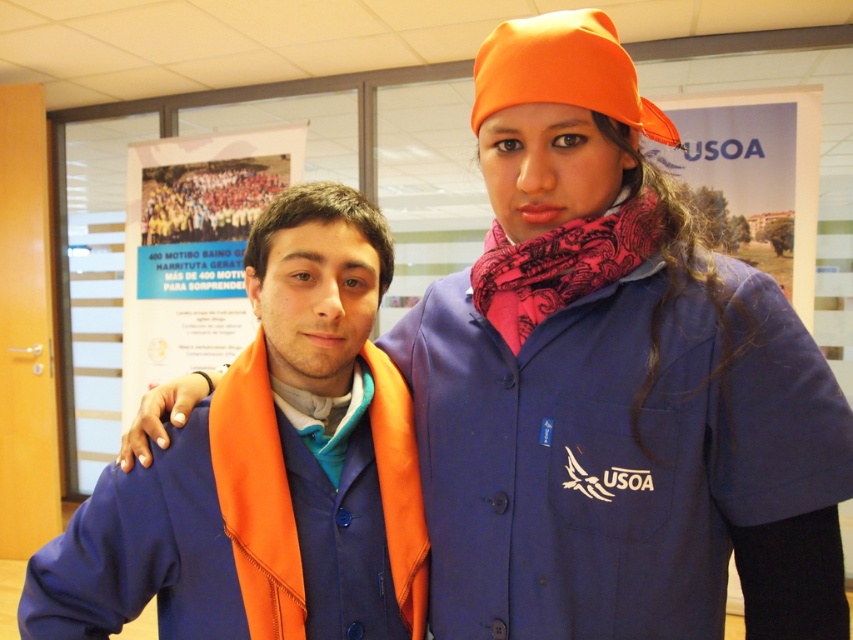
Is orange fabric hat at upper center bigger than orange fabric at center?

No, orange fabric hat at upper center is not bigger than orange fabric at center.

Between orange fabric hat at upper center and orange fabric at center, which one appears on the right side from the viewer's perspective?

Positioned to the right is orange fabric hat at upper center.

Between point (556, 67) and point (247, 196), which one is positioned behind?

Positioned behind is point (247, 196).

I want to click on orange fabric hat at upper center, so click(x=563, y=70).

How distant is pink patterned scarf at center from orange fabric at center?

They are 9.90 feet apart.

Who is more forward, (x=592, y=256) or (x=234, y=192)?

Point (x=592, y=256)

What do you see at coordinates (561, 264) in the screenshot? I see `pink patterned scarf at center` at bounding box center [561, 264].

Find the location of `pink patterned scarf at center`. pink patterned scarf at center is located at coordinates (561, 264).

Can you confirm if orange fabric hat at upper center is taller than pink patterned scarf at center?

No, orange fabric hat at upper center is not taller than pink patterned scarf at center.

Between orange fabric hat at upper center and pink patterned scarf at center, which one is positioned higher?

Positioned higher is orange fabric hat at upper center.

Describe the element at coordinates (563, 70) in the screenshot. This screenshot has width=853, height=640. I see `orange fabric hat at upper center` at that location.

The image size is (853, 640). I want to click on orange fabric hat at upper center, so click(563, 70).